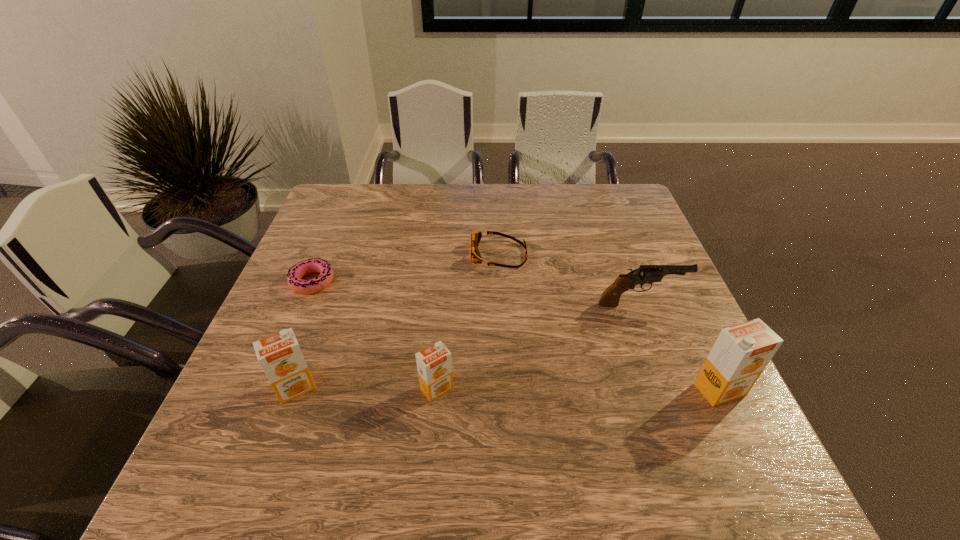
What are the coordinates of `the second shortest orange juice` in the screenshot? It's located at (279, 355).

Find the location of `the shortest orange juice`. the shortest orange juice is located at coordinates (434, 363).

This screenshot has height=540, width=960. Find the location of `the second orange juice from left to right`. the second orange juice from left to right is located at coordinates [434, 363].

At what (x,y) coordinates should I click in order to perform the action: click on the rightmost orange juice. Please return your answer as a coordinate pair (x, y). Looking at the image, I should click on (740, 354).

This screenshot has width=960, height=540. I want to click on the tallest orange juice, so click(x=740, y=354).

Locate an element on the screen. goggles is located at coordinates (475, 256).

At what (x,y) coordinates should I click in order to perform the action: click on the second shortest object. Please return your answer as a coordinate pair (x, y). This screenshot has height=540, width=960. Looking at the image, I should click on (475, 256).

The height and width of the screenshot is (540, 960). What are the coordinates of `the shortest object` in the screenshot? It's located at (313, 265).

I want to click on the third farthest object, so [x=646, y=274].

The height and width of the screenshot is (540, 960). Find the location of `vacant space situated 0.380m on the back of the second shortest orange juice`. vacant space situated 0.380m on the back of the second shortest orange juice is located at coordinates (343, 258).